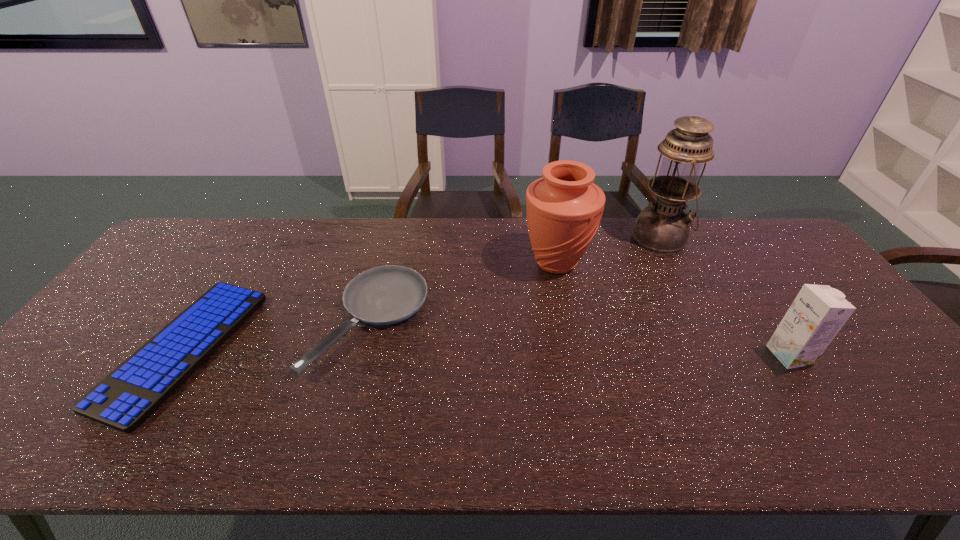
Where is `vacant point located between the fourth object from right to left and the oil lamp`? The height and width of the screenshot is (540, 960). vacant point located between the fourth object from right to left and the oil lamp is located at coordinates (516, 279).

You are a GUI agent. You are given a task and a screenshot of the screen. Output one action in this format:
    pyautogui.click(x=<x>, y=<y>)
    Task: Click on the vacant point located between the leftmost object and the carton
    This screenshot has width=960, height=540.
    Given the screenshot: What is the action you would take?
    pyautogui.click(x=487, y=352)

I want to click on the second closest object relative to the vase, so click(x=384, y=295).

At what (x,y) coordinates should I click in order to perform the action: click on object that is the third closest one to the fourth object from left to right. Please return your answer as a coordinate pair (x, y). Looking at the image, I should click on (384, 295).

Locate an element on the screen. The image size is (960, 540). blank space that satisfies the following two spatial constraints: 1. on the back side of the tallest object; 2. on the right side of the computer keyboard is located at coordinates (255, 238).

Where is `free spot that satisfies the following two spatial constraints: 1. on the front side of the fourth tallest object; 2. on the right side of the carton`? Image resolution: width=960 pixels, height=540 pixels. free spot that satisfies the following two spatial constraints: 1. on the front side of the fourth tallest object; 2. on the right side of the carton is located at coordinates (362, 355).